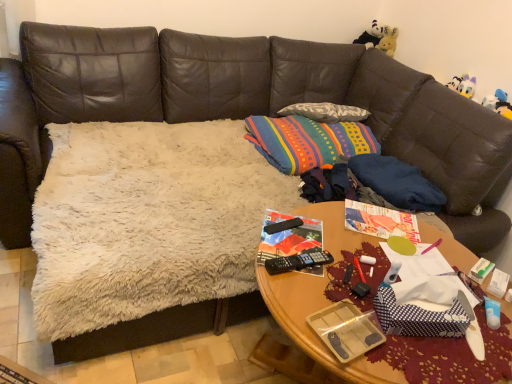
The height and width of the screenshot is (384, 512). I want to click on free space on the front side of blue dotted paper at center, so click(421, 362).